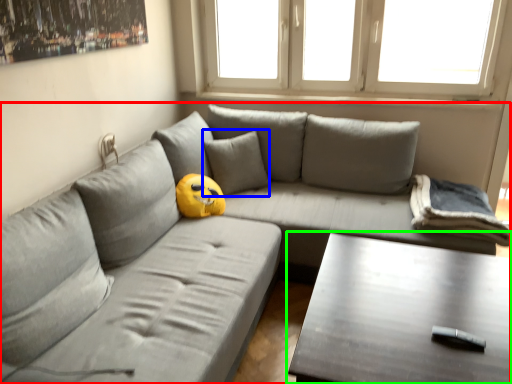
Question: Based on their relative distances, which object is nearer to studio couch (highlighted by a red box)? Choose from pillow (highlighted by a blue box) and table (highlighted by a green box).

Choices:
 (A) pillow
 (B) table

Answer: (A)